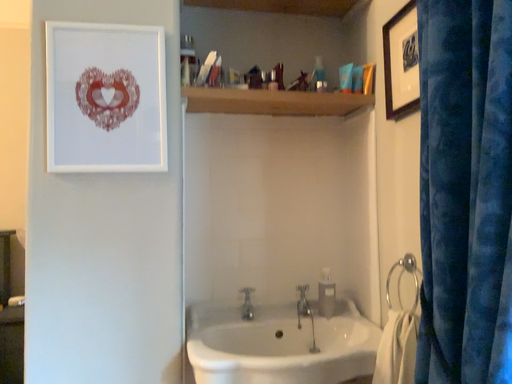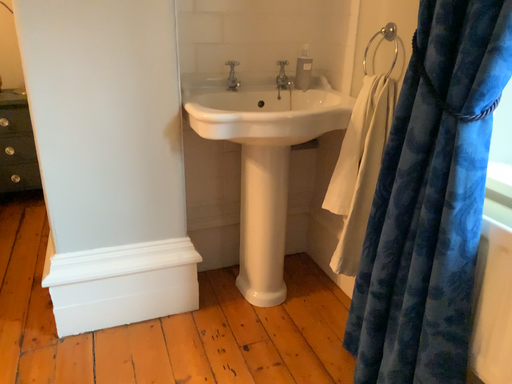
Question: How did the camera likely rotate when shooting the video?

Choices:
 (A) rotated right
 (B) rotated left

Answer: (A)